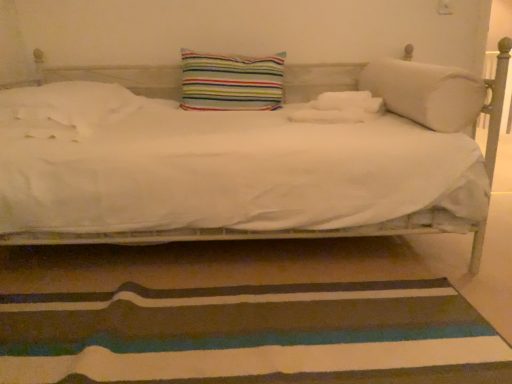
Question: Considering their positions, is white soft pillow at left, marked as the 3th pillow in a right-to-left arrangement, located in front of or behind striped fabric pillow at center, marked as the 2th pillow in a right-to-left arrangement?

Choices:
 (A) behind
 (B) front

Answer: (B)

Question: Considering the positions of white soft pillow at left, marked as the 3th pillow in a right-to-left arrangement, and striped fabric pillow at center, arranged as the 2th pillow when viewed from the left, in the image, is white soft pillow at left, marked as the 3th pillow in a right-to-left arrangement, taller or shorter than striped fabric pillow at center, arranged as the 2th pillow when viewed from the left,?

Choices:
 (A) tall
 (B) short

Answer: (B)

Question: Considering the real-world distances, which object is closest to the white soft cylindrical pillow at right, the first pillow viewed from the right?

Choices:
 (A) white soft pillow at left, the 1th pillow positioned from the left
 (B) striped fabric pillow at center, arranged as the 2th pillow when viewed from the left
 (C) striped fabric doormat at lower center

Answer: (B)

Question: Estimate the real-world distances between objects in this image. Which object is closer to the white soft pillow at left, marked as the 3th pillow in a right-to-left arrangement?

Choices:
 (A) striped fabric doormat at lower center
 (B) white soft cylindrical pillow at right, marked as the 3th pillow in a left-to-right arrangement
 (C) striped fabric pillow at center, arranged as the 2th pillow when viewed from the left

Answer: (C)